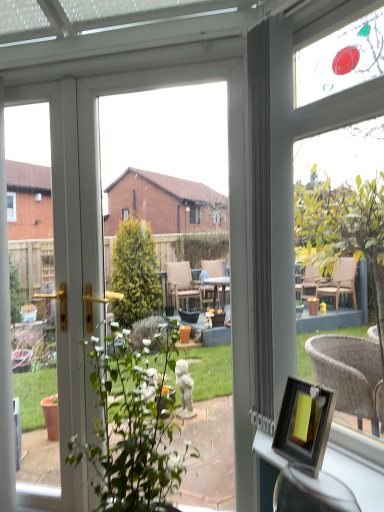
The image size is (384, 512). Describe the element at coordinates (357, 464) in the screenshot. I see `wooden frame at lower right` at that location.

What do you see at coordinates (292, 180) in the screenshot? I see `matte wicker chair at upper right` at bounding box center [292, 180].

Locate an element on the screen. The width and height of the screenshot is (384, 512). wooden frame at lower right is located at coordinates (357, 464).

Find the location of a particular element. picture frame on the right side of wooden frame at lower right is located at coordinates (304, 423).

Is wooden picture frame at lower right at the back of wooden frame at lower right?

Yes, wooden frame at lower right is positioned with its back facing wooden picture frame at lower right.

From a real-world perspective, is wooden frame at lower right under wooden picture frame at lower right?

Correct, in the physical world, wooden frame at lower right is lower than wooden picture frame at lower right.

Is wooden frame at lower right not inside wooden picture frame at lower right?

That's correct, wooden frame at lower right is outside of wooden picture frame at lower right.

Locate an element on the screen. window sill below the wooden picture frame at lower right (from the image's perspective) is located at coordinates (357, 464).

Is point (288, 396) in front of point (359, 471)?

That is False.

From the image's perspective, which one is positioned lower, wooden picture frame at lower right or wooden frame at lower right?

wooden frame at lower right is shown below in the image.

Based on the photo, between matte wicker chair at upper right and green leafy plant at center, which one has larger width?

With larger width is green leafy plant at center.

From a real-world perspective, which is physically below, matte wicker chair at upper right or green leafy plant at center?

From a 3D spatial view, green leafy plant at center is below.

From the picture: Is the depth of matte wicker chair at upper right greater than that of green leafy plant at center?

Yes, matte wicker chair at upper right is behind green leafy plant at center.

Does matte wicker chair at upper right contain green leafy plant at center?

No, green leafy plant at center is located outside of matte wicker chair at upper right.

Would you consider green leafy plant at center to be distant from wooden picture frame at lower right?

Actually, green leafy plant at center and wooden picture frame at lower right are a little close together.

Looking at their sizes, would you say green leafy plant at center is wider or thinner than wooden picture frame at lower right?

green leafy plant at center is wider than wooden picture frame at lower right.

Between green leafy plant at center and wooden picture frame at lower right, which one has more height?

Standing taller between the two is green leafy plant at center.

There is a green leafy plant at center. Where is `picture frame above it (from a real-world perspective)`? picture frame above it (from a real-world perspective) is located at coordinates (304, 423).

Could you tell me if wooden picture frame at lower right is facing green leafy plant at center?

No, wooden picture frame at lower right is not turned towards green leafy plant at center.

Is wooden picture frame at lower right bigger than green leafy plant at center?

No.

Is wooden frame at lower right surrounded by matte wicker chair at upper right?

No, wooden frame at lower right is not inside matte wicker chair at upper right.

Is point (310, 42) positioned in front of point (364, 446)?

No, it is behind (364, 446).

Relative to wooden frame at lower right, is matte wicker chair at upper right in front or behind?

In the image, matte wicker chair at upper right appears behind wooden frame at lower right.

Can you tell me how much matte wicker chair at upper right and wooden frame at lower right differ in facing direction?

They differ by 0.00929 degrees in their facing directions.

Is wooden frame at lower right with matte wicker chair at upper right?

wooden frame at lower right and matte wicker chair at upper right are clearly separated.

Between wooden frame at lower right and matte wicker chair at upper right, which one appears on the left side from the viewer's perspective?

wooden frame at lower right.

Where is `window sill in front of the matte wicker chair at upper right`? The height and width of the screenshot is (512, 384). window sill in front of the matte wicker chair at upper right is located at coordinates (357, 464).

Can you confirm if wooden frame at lower right is wider than matte wicker chair at upper right?

Yes.

At what (x,y) coordinates should I click in order to perform the action: click on window sill on the left of wooden picture frame at lower right. Please return your answer as a coordinate pair (x, y). This screenshot has height=512, width=384. Looking at the image, I should click on (357, 464).

Identify the location of window sill below the wooden picture frame at lower right (from the image's perspective). The height and width of the screenshot is (512, 384). tap(357, 464).

From the picture: Considering their positions, is green leafy plant at center positioned further to matte wicker chair at upper right than wooden picture frame at lower right?

The object further to matte wicker chair at upper right is green leafy plant at center.

Looking at the image, which one is located further to green leafy plant at center, wooden picture frame at lower right or matte wicker chair at upper right?

matte wicker chair at upper right.

Looking at the image, which one is located closer to green leafy plant at center, matte wicker chair at upper right or wooden frame at lower right?

Among the two, wooden frame at lower right is located nearer to green leafy plant at center.

Looking at the image, which one is located further to wooden frame at lower right, matte wicker chair at upper right or wooden picture frame at lower right?

matte wicker chair at upper right lies further to wooden frame at lower right than the other object.

Which object lies further to the anchor point green leafy plant at center, wooden picture frame at lower right or wooden frame at lower right?

wooden picture frame at lower right is positioned further to the anchor green leafy plant at center.

When comparing their distances from green leafy plant at center, does matte wicker chair at upper right or wooden picture frame at lower right seem further?

matte wicker chair at upper right is further to green leafy plant at center.

Based on their spatial positions, is green leafy plant at center or wooden frame at lower right closer to wooden picture frame at lower right?

The object closer to wooden picture frame at lower right is wooden frame at lower right.

Which object lies further to the anchor point matte wicker chair at upper right, wooden picture frame at lower right or green leafy plant at center?

Based on the image, green leafy plant at center appears to be further to matte wicker chair at upper right.

I want to click on window sill between matte wicker chair at upper right and green leafy plant at center in the vertical direction, so click(357, 464).

Where is `window sill between green leafy plant at center and wooden picture frame at lower right`? Image resolution: width=384 pixels, height=512 pixels. window sill between green leafy plant at center and wooden picture frame at lower right is located at coordinates (357, 464).

The image size is (384, 512). In order to click on picture frame between matte wicker chair at upper right and green leafy plant at center in the vertical direction in this screenshot , I will do `click(304, 423)`.

In order to click on picture frame between matte wicker chair at upper right and wooden frame at lower right in the up-down direction in this screenshot , I will do `click(304, 423)`.